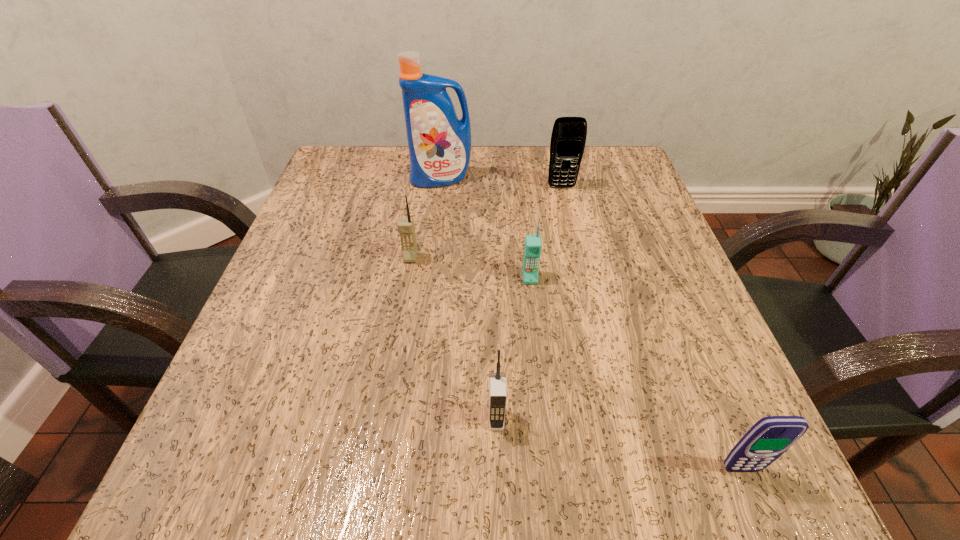
You are a GUI agent. You are given a task and a screenshot of the screen. Output one action in this format:
    pyautogui.click(x=<x>, y=<y>)
    Task: Click on the vacant region at the far edge of the desktop
    This screenshot has height=540, width=960.
    Given the screenshot: What is the action you would take?
    pyautogui.click(x=408, y=168)

The height and width of the screenshot is (540, 960). I want to click on vacant space at the near edge, so click(x=568, y=482).

You are a GUI agent. You are given a task and a screenshot of the screen. Output one action in this format:
    pyautogui.click(x=<x>, y=<y>)
    Task: Click on the free location at the left edge of the desktop
    The width and height of the screenshot is (960, 540).
    Given the screenshot: What is the action you would take?
    pyautogui.click(x=305, y=211)

This screenshot has width=960, height=540. In the image, there is a desktop. Identify the location of vacant space at the right edge. (603, 244).

You are a GUI agent. You are given a task and a screenshot of the screen. Output one action in this format:
    pyautogui.click(x=<x>, y=<y>)
    Task: Click on the vacant space at the far left corner
    This screenshot has width=960, height=540.
    Given the screenshot: What is the action you would take?
    pyautogui.click(x=365, y=173)

In the image, there is a desktop. Find the location of `free space at the near left corner`. free space at the near left corner is located at coordinates (204, 494).

Image resolution: width=960 pixels, height=540 pixels. In the image, there is a desktop. Identify the location of vacant space at the far right corner. (613, 174).

Where is `vacant area that lies between the second cellular telephone from left to right and the leftmost cellular telephone`? This screenshot has height=540, width=960. vacant area that lies between the second cellular telephone from left to right and the leftmost cellular telephone is located at coordinates (453, 339).

Find the location of a particular element. The width and height of the screenshot is (960, 540). empty location between the tallest object and the fourth nearest cellular telephone is located at coordinates (426, 219).

Find the location of a particular element. free area in between the tallest object and the third nearest cellular telephone is located at coordinates (486, 228).